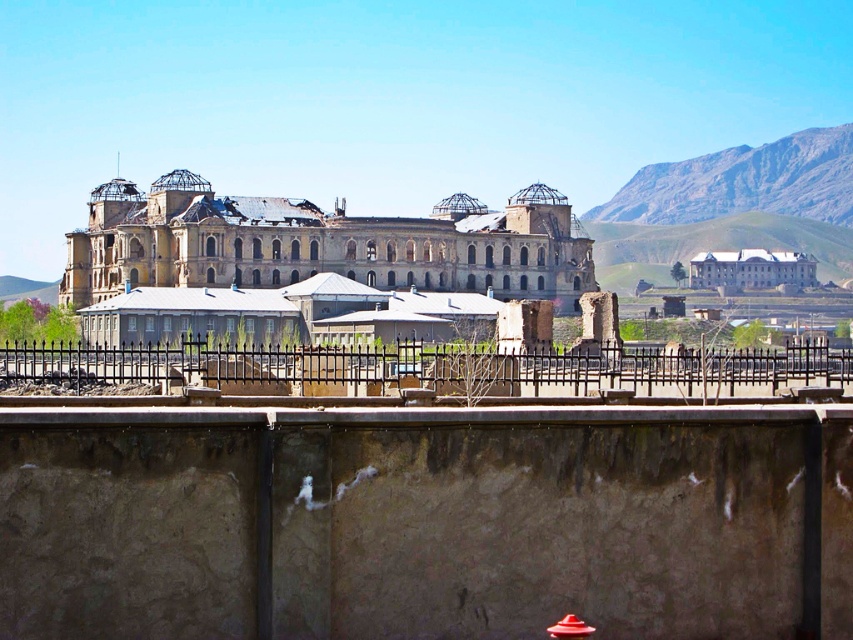
You are a visitor standing in front of the weathered stone palace at center and the matte red fire hydrant at center. Which object is closer to you?

The weathered stone palace at center is closer to you because the matte red fire hydrant at center is behind it.

You are a painter standing at the base of the dilapidated building. You need to paint both the black wrought iron fence at center and the matte red fire hydrant at center. Which object should you paint first if you want to start with the larger one?

The black wrought iron fence at center is bigger than the matte red fire hydrant at center, so you should paint the black wrought iron fence at center first.

You are standing at the entrance of the white smooth building at center and want to reach the matte red fire hydrant at center. Which direction should you move to get closer to the hydrant?

Since the white smooth building at center is further away than the matte red fire hydrant at center, you should move forward towards the hydrant to get closer.